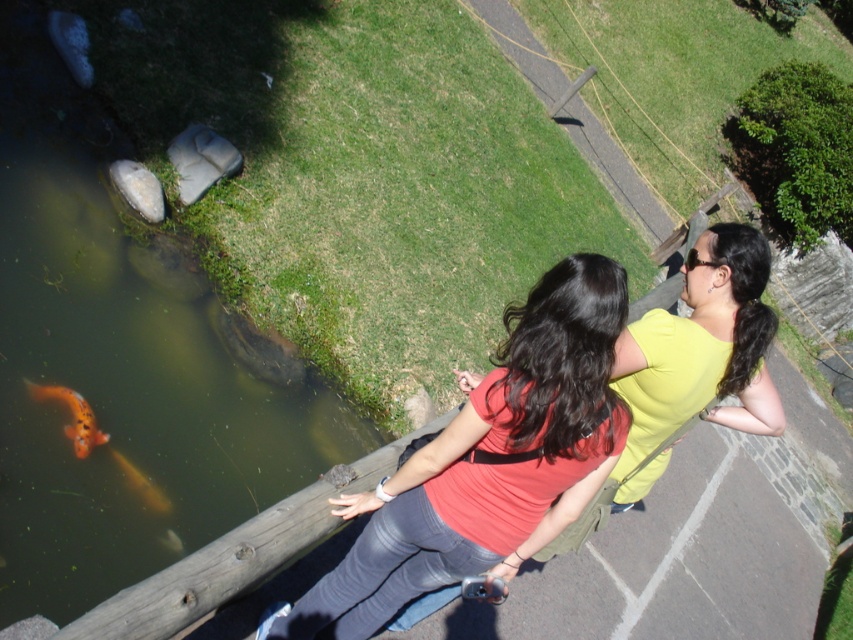
In the scene shown: You are standing at the point with coordinates point (70, 426) and want to walk to the point with coordinates point (515, 353). Since both points are on the paved pathway, will you be moving towards the water or away from it?

Point (515, 353) is in front of point (70, 426), so moving from point (70, 426) to point (515, 353) means you are moving towards the water.

You are standing at the origin point in the image. The origin is at the bottom left corner of the image. The coordinates are normalized between 0 and 1. Which direction should you move to reach the matte red shirt at center?

The matte red shirt at center is located at coordinates point (486, 464). Since the origin is at the bottom left corner, you should move to the right and slightly upwards to reach it.